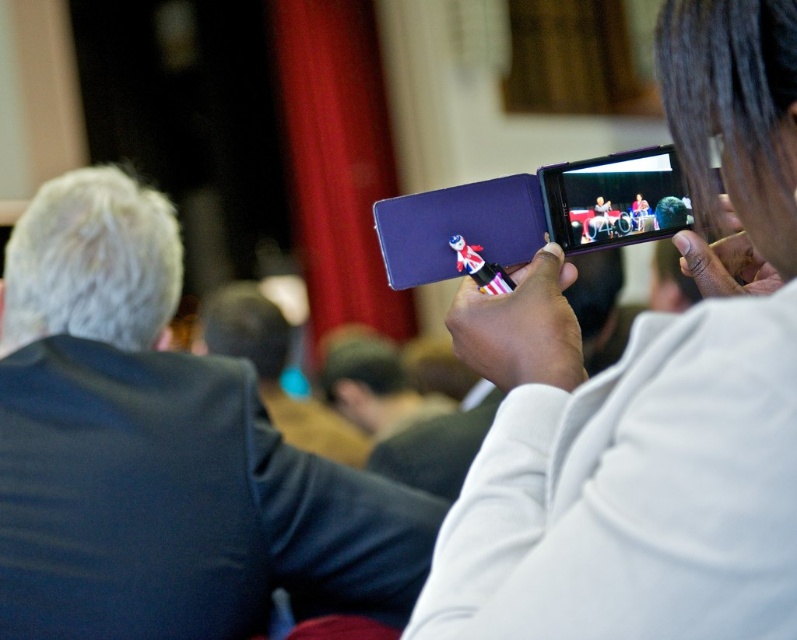
Question: Where is matte purple phone at upper right located in relation to dark brown leather jacket at center in the image?

Choices:
 (A) left
 (B) right

Answer: (B)

Question: Which object is closer to the camera taking this photo?

Choices:
 (A) dark blue suit at left
 (B) dark brown leather jacket at center
 (C) matte purple phone at upper right

Answer: (C)

Question: Is dark blue suit at left thinner than dark brown leather jacket at center?

Choices:
 (A) yes
 (B) no

Answer: (B)

Question: Which point is farther to the camera?

Choices:
 (A) (154, 358)
 (B) (291, 438)

Answer: (B)

Question: Which of these objects is positioned closest to the dark brown leather jacket at center?

Choices:
 (A) dark blue suit at left
 (B) matte purple phone at upper right

Answer: (A)

Question: Does matte purple phone at upper right come in front of dark brown leather jacket at center?

Choices:
 (A) no
 (B) yes

Answer: (B)